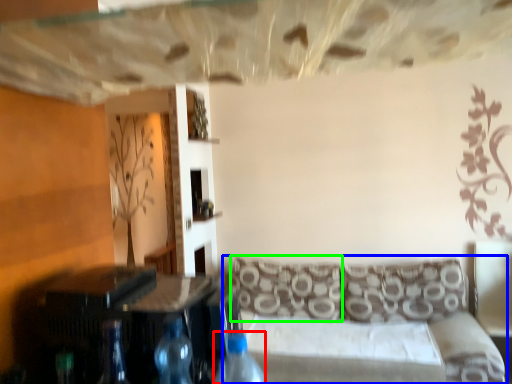
Question: Estimate the real-world distances between objects in this image. Which object is farther from bottle (highlighted by a red box), studio couch (highlighted by a blue box) or pillow (highlighted by a green box)?

Choices:
 (A) studio couch
 (B) pillow

Answer: (B)